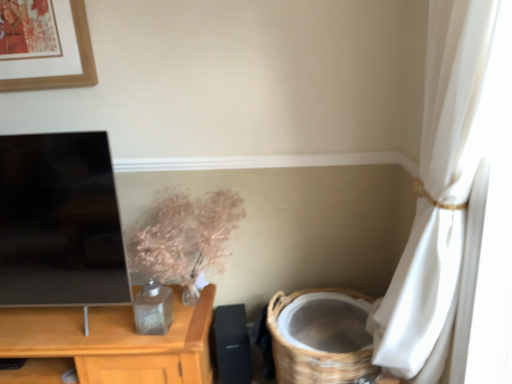
Question: Is black matte speaker at lower center completely or partially outside of metallic floral arrangement at center?

Choices:
 (A) yes
 (B) no

Answer: (A)

Question: Is black matte speaker at lower center bigger than metallic floral arrangement at center?

Choices:
 (A) yes
 (B) no

Answer: (B)

Question: Is metallic floral arrangement at center completely or partially inside black matte speaker at lower center?

Choices:
 (A) no
 (B) yes

Answer: (A)

Question: Is black matte speaker at lower center shorter than metallic floral arrangement at center?

Choices:
 (A) no
 (B) yes

Answer: (B)

Question: Is black matte speaker at lower center positioned with its back to metallic floral arrangement at center?

Choices:
 (A) yes
 (B) no

Answer: (B)

Question: In terms of size, does black matte speaker at lower center appear bigger or smaller than metallic floral arrangement at center?

Choices:
 (A) big
 (B) small

Answer: (B)

Question: Considering the positions of point (215, 314) and point (243, 208), is point (215, 314) closer or farther from the camera than point (243, 208)?

Choices:
 (A) farther
 (B) closer

Answer: (A)

Question: Is black matte speaker at lower center inside or outside of metallic floral arrangement at center?

Choices:
 (A) outside
 (B) inside

Answer: (A)

Question: In terms of height, does black matte speaker at lower center look taller or shorter compared to metallic floral arrangement at center?

Choices:
 (A) tall
 (B) short

Answer: (B)

Question: From the image's perspective, is metallic floral arrangement at center above or below woven brown basket at lower right?

Choices:
 (A) below
 (B) above

Answer: (B)

Question: In terms of width, does metallic floral arrangement at center look wider or thinner when compared to woven brown basket at lower right?

Choices:
 (A) wide
 (B) thin

Answer: (B)

Question: Considering the positions of metallic floral arrangement at center and woven brown basket at lower right in the image, is metallic floral arrangement at center bigger or smaller than woven brown basket at lower right?

Choices:
 (A) big
 (B) small

Answer: (B)

Question: Is point (142, 241) positioned closer to the camera than point (294, 365)?

Choices:
 (A) closer
 (B) farther

Answer: (B)

Question: From their relative heights in the image, would you say metallic floral arrangement at center is taller or shorter than black matte speaker at lower center?

Choices:
 (A) tall
 (B) short

Answer: (A)

Question: From the image's perspective, is metallic floral arrangement at center located above or below black matte speaker at lower center?

Choices:
 (A) above
 (B) below

Answer: (A)